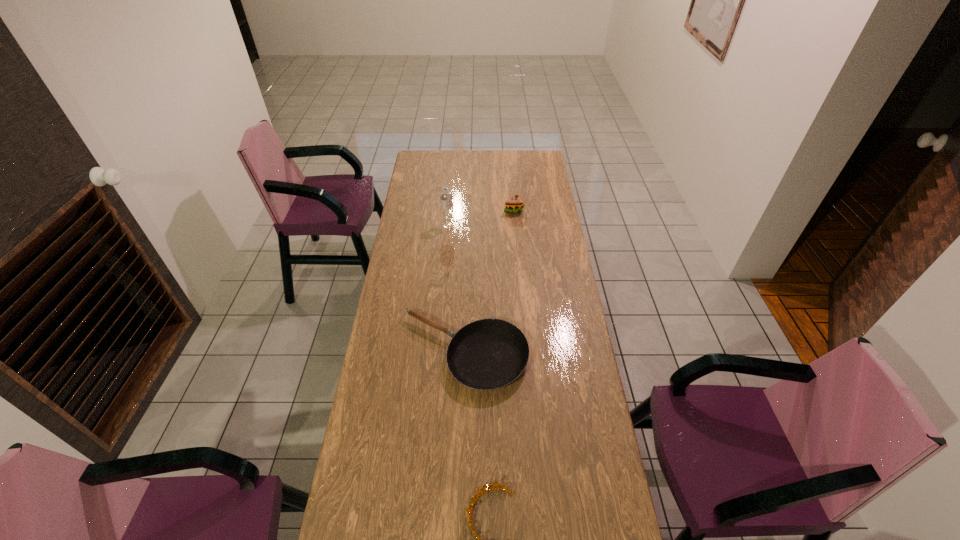
The image size is (960, 540). I want to click on empty space between the frying pan and the third shortest object, so click(x=489, y=281).

The width and height of the screenshot is (960, 540). What are the coordinates of `object that stands as the second closest to the water bottle` in the screenshot? It's located at point(487,354).

The height and width of the screenshot is (540, 960). I want to click on object that is the closest one to the tiara, so click(487, 354).

This screenshot has width=960, height=540. In order to click on vacant position in the image that satisfies the following two spatial constraints: 1. on the back side of the second farthest object; 2. on the left side of the farthest object in this screenshot , I will do `click(449, 210)`.